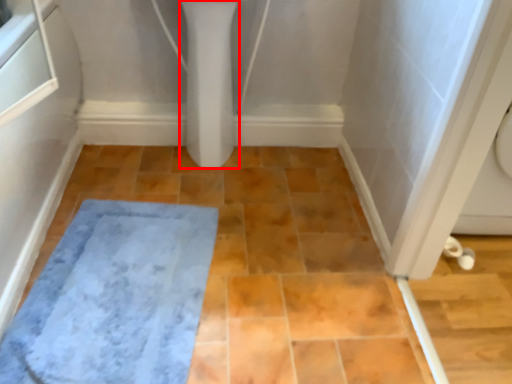
Question: From the image's perspective, where is bidet (annotated by the red box) located in relation to bath mat in the image?

Choices:
 (A) above
 (B) below

Answer: (A)